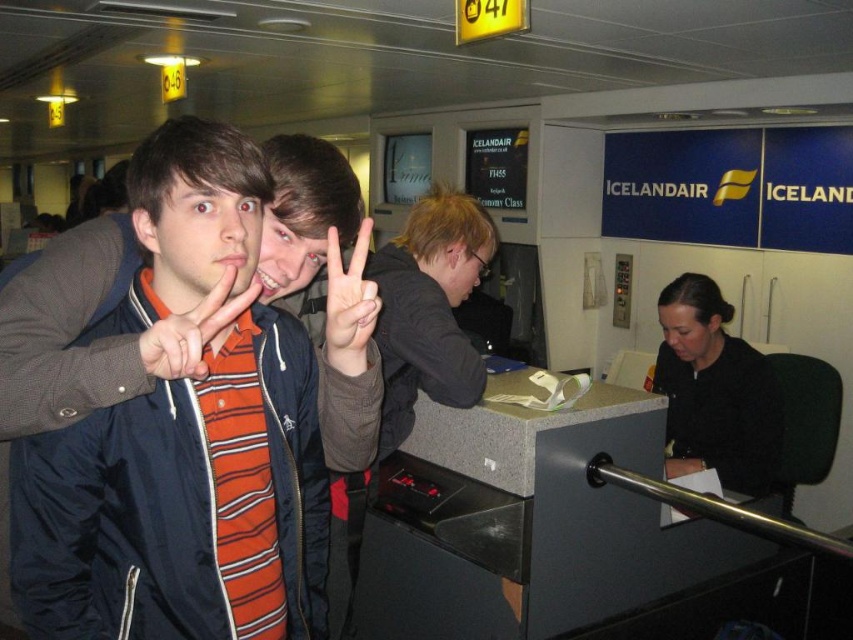
Question: Which of these objects is positioned closest to the matte orange shirt at center?

Choices:
 (A) matte orange striped shirt at center
 (B) matte blue jacket at center

Answer: (B)

Question: Which point is closer to the camera?

Choices:
 (A) matte orange striped shirt at center
 (B) matte orange shirt at center
 (C) matte blue jacket at center

Answer: (B)

Question: Does matte orange shirt at center appear under matte orange striped shirt at center?

Choices:
 (A) yes
 (B) no

Answer: (A)

Question: Which of the following is the closest to the observer?

Choices:
 (A) matte orange shirt at center
 (B) matte orange striped shirt at center

Answer: (A)

Question: Can you confirm if matte blue jacket at center is positioned above matte orange shirt at center?

Choices:
 (A) no
 (B) yes

Answer: (A)

Question: Can you confirm if matte blue jacket at center is positioned above matte orange shirt at center?

Choices:
 (A) no
 (B) yes

Answer: (A)